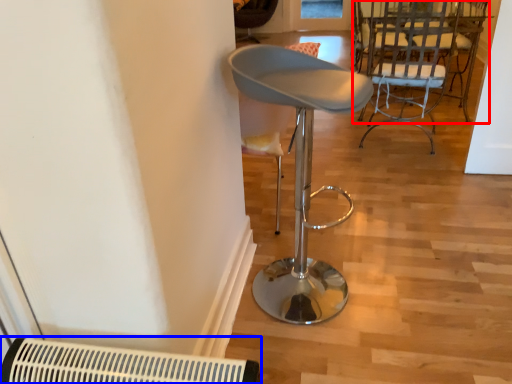
Question: Which object is further to the camera taking this photo, chair (highlighted by a red box) or air conditioning (highlighted by a blue box)?

Choices:
 (A) chair
 (B) air conditioning

Answer: (A)